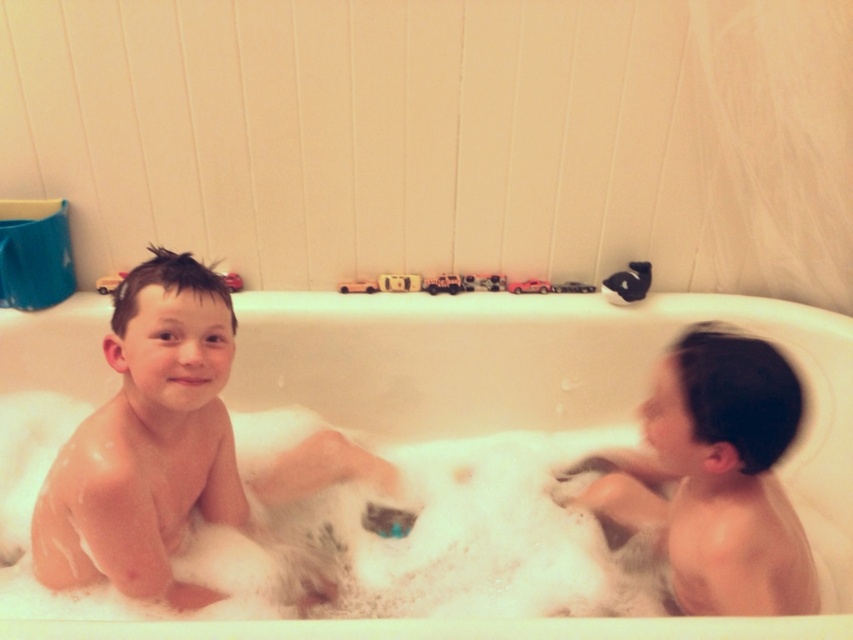
You are a photographer trying to capture the perfect shot of the children in the bath. To ensure the foamy white at bath bottom is centered in your photo, where should you position your camera relative to the bath?

The foamy white at bath bottom is located at point (364, 536), so to center it in the photo, the camera should be positioned directly above that coordinate.

You are a photographer setting up for a family portrait in the bathroom. You need to position a small stool behind the smooth skin child at left and the smooth skin child at right to ensure they are both visible. Given their heights, which child requires a taller stool to be seen clearly?

The smooth skin child at left has a greater height compared to smooth skin child at right, so the smooth skin child at right requires a taller stool to be seen clearly.